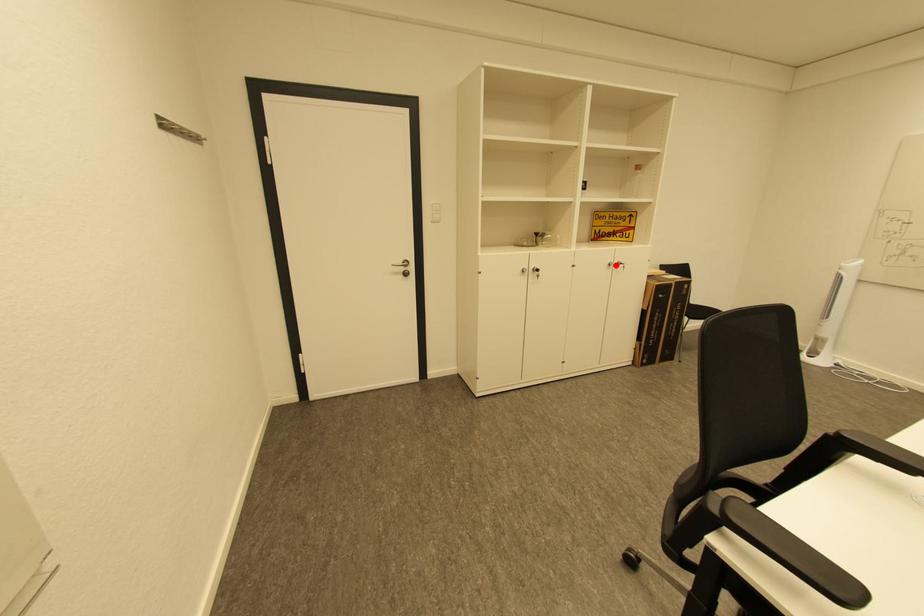
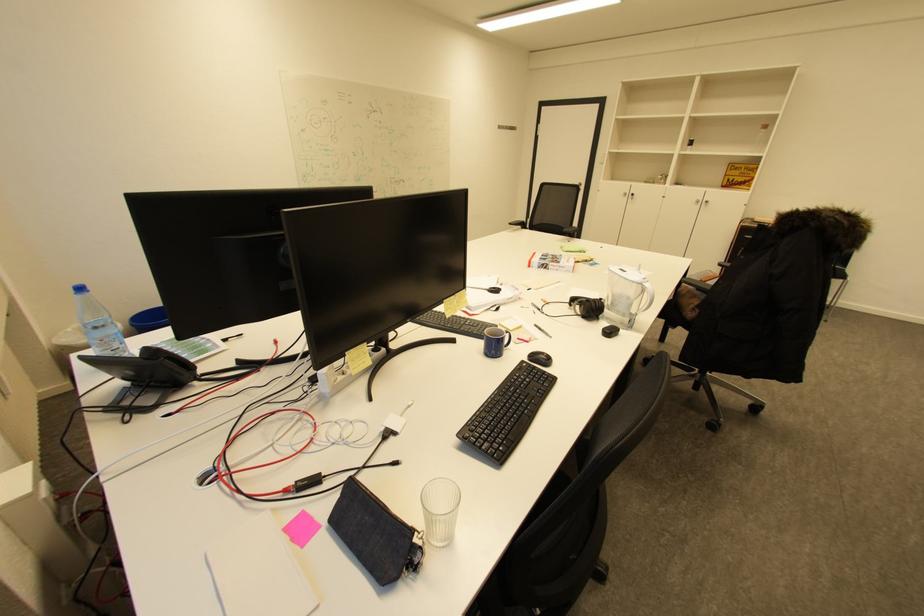
Question: I am providing you with two images of the same scene from different viewpoints. A red point is marked on the first image. Is the red point's position out of view in image 2?

Choices:
 (A) Yes
 (B) No

Answer: (B)